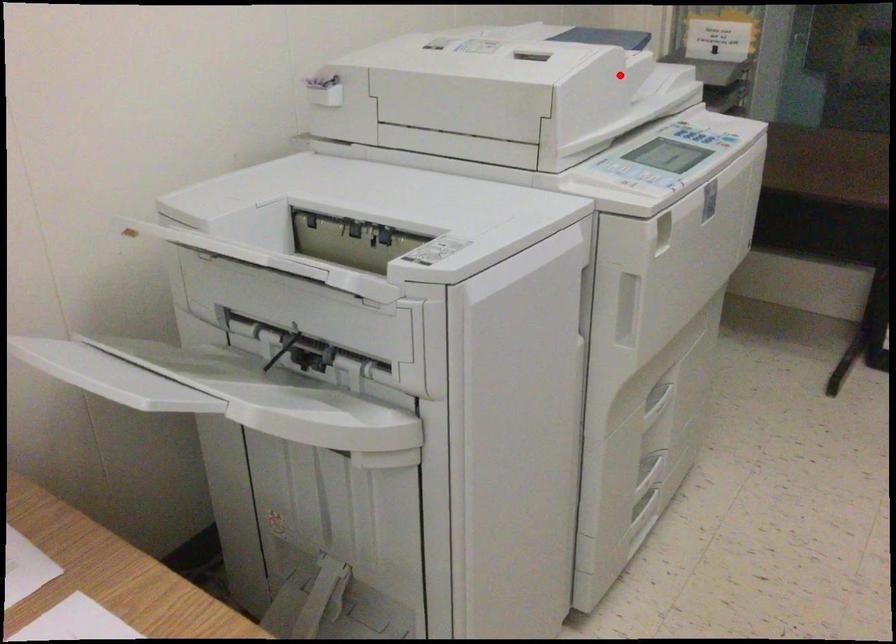
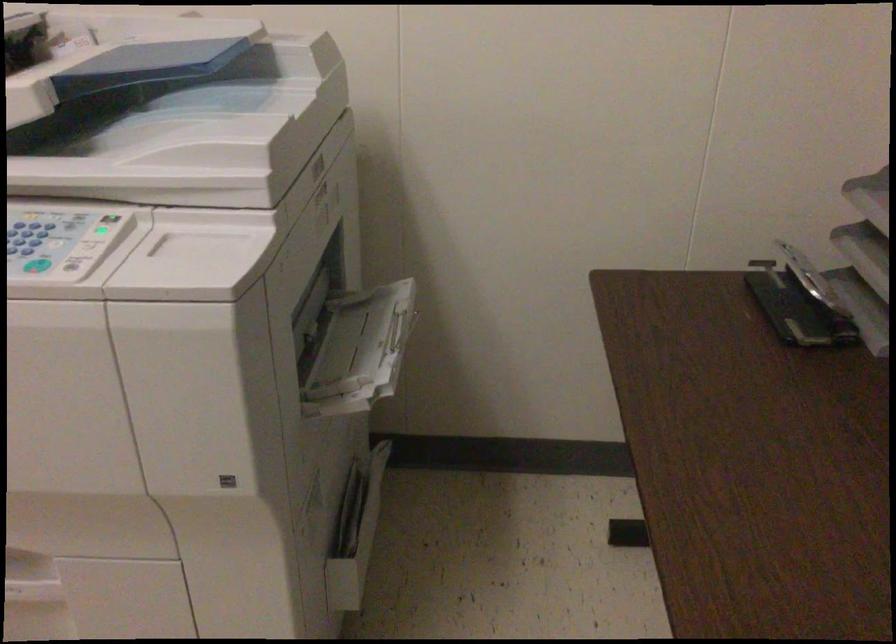
Where in the second image is the point corresponding to the highlighted location from the first image?

(173, 126)